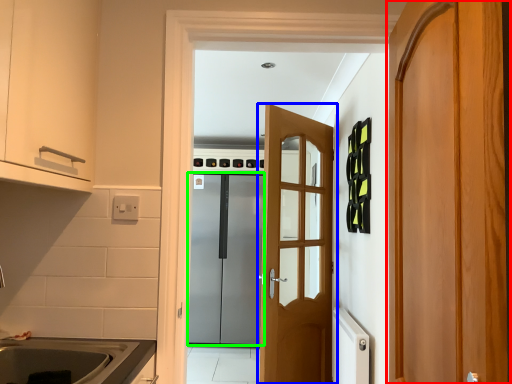
Question: Considering the real-world distances, which object is closest to door (highlighted by a red box)? door (highlighted by a blue box) or door (highlighted by a green box).

Choices:
 (A) door
 (B) door

Answer: (A)